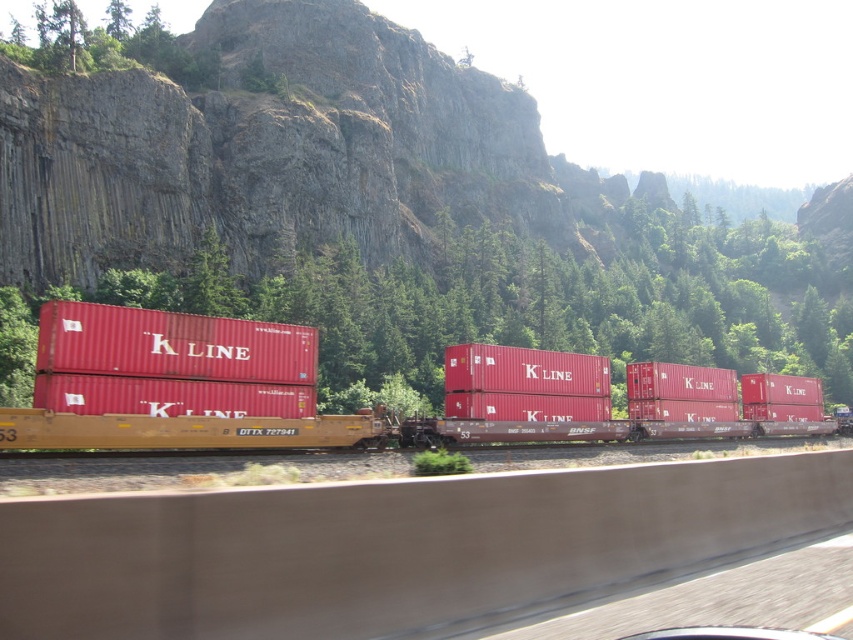
Question: From the image, what is the correct spatial relationship of matte red shipping container at center in relation to matte red container at center?

Choices:
 (A) above
 (B) below

Answer: (B)

Question: Which point is farther from the camera taking this photo?

Choices:
 (A) (178, 312)
 (B) (578, 384)

Answer: (A)

Question: Considering the relative positions of matte red shipping container at center and matte red container at center in the image provided, where is matte red shipping container at center located with respect to matte red container at center?

Choices:
 (A) right
 (B) left

Answer: (A)

Question: Which object is closer to the camera taking this photo?

Choices:
 (A) matte red container at center
 (B) matte red shipping container at center

Answer: (B)

Question: In this image, where is matte red shipping container at center located relative to matte red container at center?

Choices:
 (A) below
 (B) above

Answer: (A)